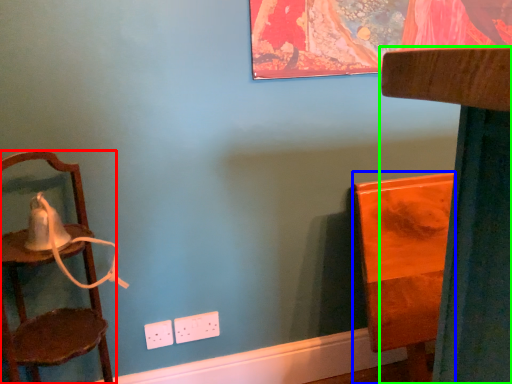
Question: Considering the real-world distances, which object is farthest from chair (highlighted by a red box)? furniture (highlighted by a blue box) or furniture (highlighted by a green box)?

Choices:
 (A) furniture
 (B) furniture

Answer: (B)